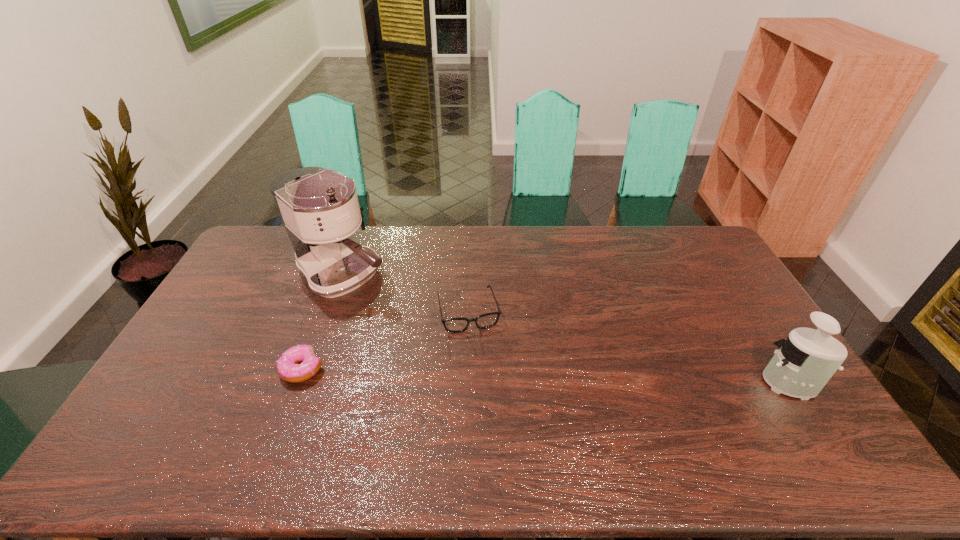
Locate an element on the screen. free space located on the front-facing side of the tallest object is located at coordinates (462, 354).

The width and height of the screenshot is (960, 540). In order to click on free location located on the front-facing side of the third tallest object in this screenshot , I will do `click(483, 366)`.

Image resolution: width=960 pixels, height=540 pixels. I want to click on vacant region located 0.110m on the front-facing side of the third tallest object, so click(481, 361).

Find the location of a particular element. free space located 0.290m on the front-facing side of the third tallest object is located at coordinates (494, 413).

Find the location of a particular element. This screenshot has height=540, width=960. object that is at the far edge is located at coordinates (319, 208).

Locate an element on the screen. object that is at the right edge is located at coordinates (804, 363).

In the image, there is a desktop. Where is `vacant region at the far edge`? vacant region at the far edge is located at coordinates (612, 254).

Locate an element on the screen. free space at the near edge is located at coordinates (499, 418).

In the image, there is a desktop. Identify the location of blank space at the left edge. The image size is (960, 540). (208, 370).

This screenshot has width=960, height=540. Identify the location of vacant space at the right edge of the desktop. (741, 305).